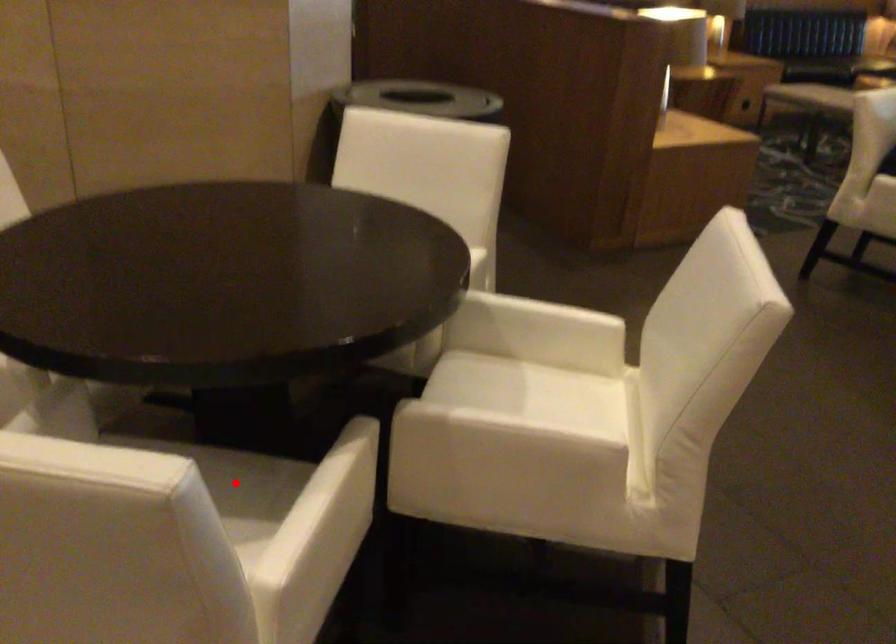
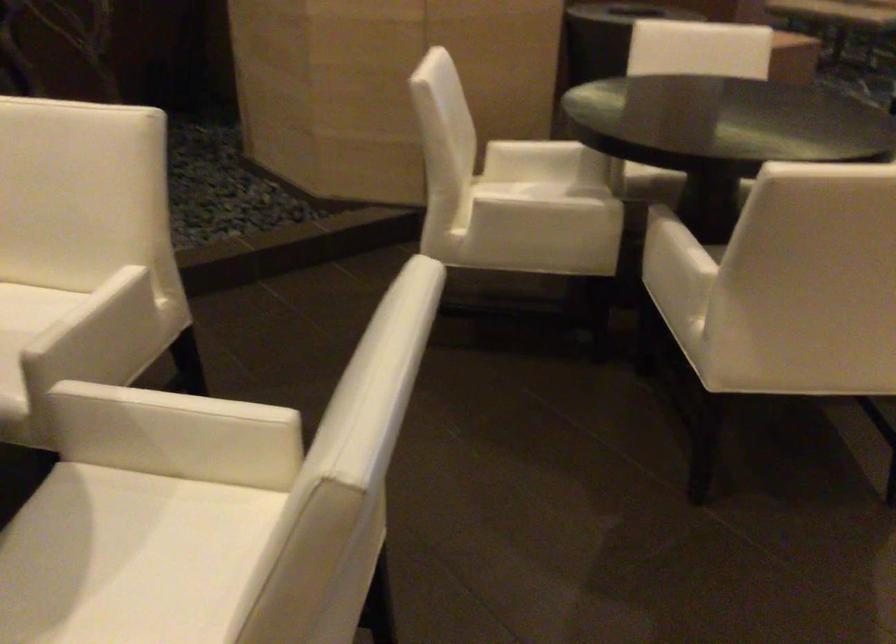
Question: I am providing you with two images of the same scene from different viewpoints. A red point is marked on the first image. At the location where the point appears in image 1, is it still visible in image 2?

Choices:
 (A) Yes
 (B) No

Answer: (B)